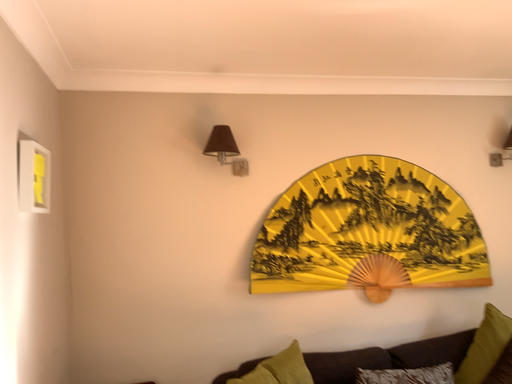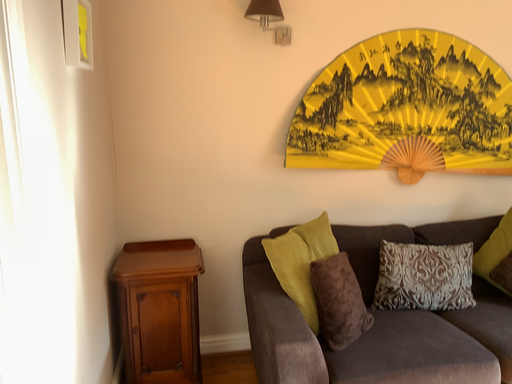
Question: How did the camera likely rotate when shooting the video?

Choices:
 (A) rotated downward
 (B) rotated upward

Answer: (A)